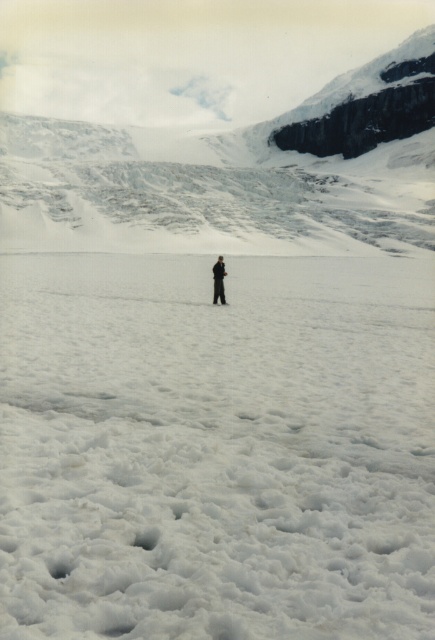
You are a hiker planning to cross the glacier. You see the snowy rock at upper center and the blurred figure at center in the distance. How far apart are these two landmarks from each other?

The snowy rock at upper center and the blurred figure at center are 205.70 meters apart.

From the picture: You are planning to take a photo of the blurred figure at center and the white fluffy snow at center in the snowy landscape. To ensure both are in focus, what is the minimum distance you need to set the camera focus to?

The minimum focus distance should be set to 7.27 meters to ensure both the blurred figure at center and the white fluffy snow at center are in focus since they are 7.27 meters apart.

You are planning to build a snowman using the white fluffy snow at center and the snowy rock at upper center. Which material would you choose and why?

You should choose the white fluffy snow at center because it occupies less space than the snowy rock at upper center, making it easier to gather enough snow for building the snowman.